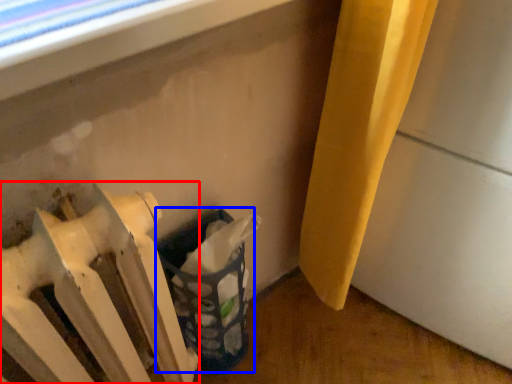
Question: Which of the following is the farthest to the observer, radiator (highlighted by a red box) or laundry basket (highlighted by a blue box)?

Choices:
 (A) radiator
 (B) laundry basket

Answer: (B)